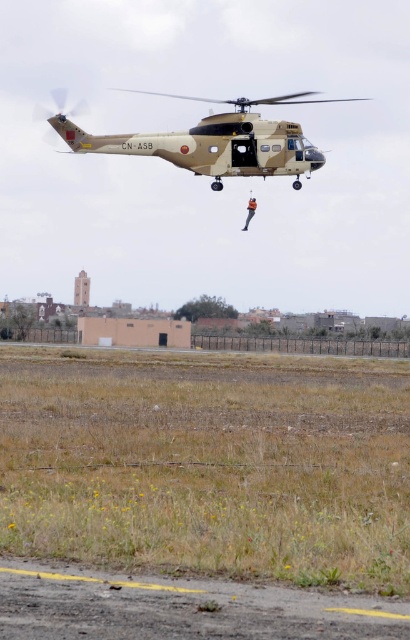
You are a pilot observing the scene from above. You see the dark gray asphalt runway at lower center and the camouflage fabric helicopter at center. Which object appears larger in the image?

The camouflage fabric helicopter at center appears larger than the dark gray asphalt runway at lower center in the image.

You are a pilot flying a small plane and need to land on the runway. The camouflage fabric helicopter at center is currently in your way. Can you safely navigate around it to reach the dark gray asphalt runway at lower center?

The dark gray asphalt runway at lower center is positioned on the left side of the camouflage fabric helicopter at center, so you can safely navigate around the helicopter by moving to its left to reach the runway.

You are a pilot preparing to land the camouflage fabric helicopter at center on the dark gray asphalt runway at lower center. Based on the runway width, will the helicopter fit on the runway during landing?

The dark gray asphalt runway at lower center has a lesser width compared to the camouflage fabric helicopter at center, so the helicopter will not fit on the runway during landing due to the runway being narrower than the helicopter.